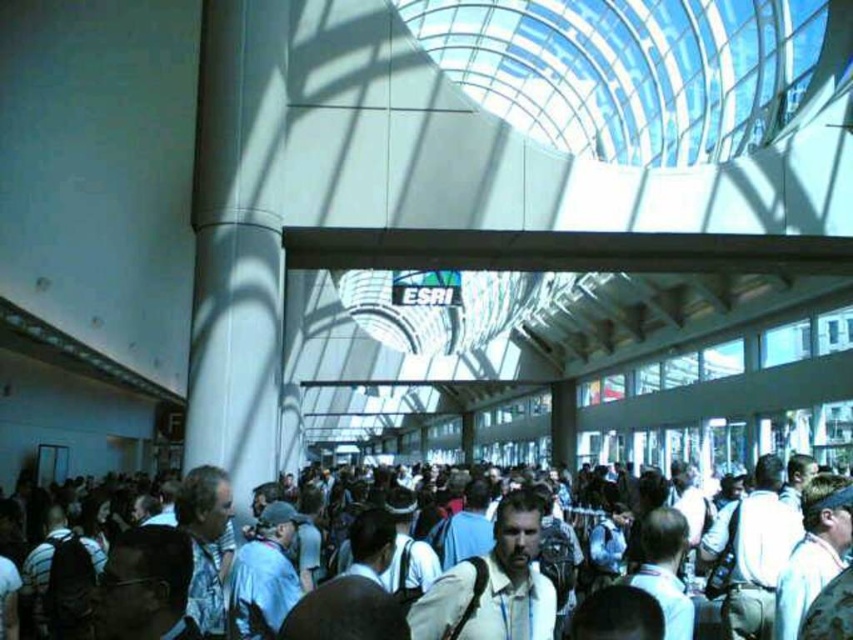
Between white fabric crowd at center and light beige shirt at center, which one has more height?

white fabric crowd at center

Is white fabric crowd at center below light beige shirt at center?

Indeed, white fabric crowd at center is positioned under light beige shirt at center.

Who is more distant from viewer, (527, 621) or (544, 605)?

The point (544, 605) is more distant.

You are a GUI agent. You are given a task and a screenshot of the screen. Output one action in this format:
    pyautogui.click(x=<x>, y=<y>)
    Task: Click on the white fabric crowd at center
    
    Given the screenshot: What is the action you would take?
    pyautogui.click(x=393, y=592)